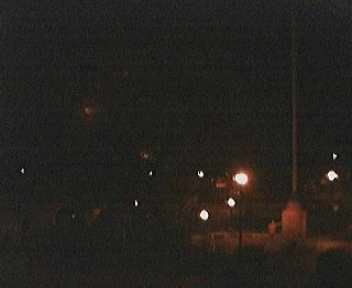
Identify the location of orange glowing light biggest. (239, 179).